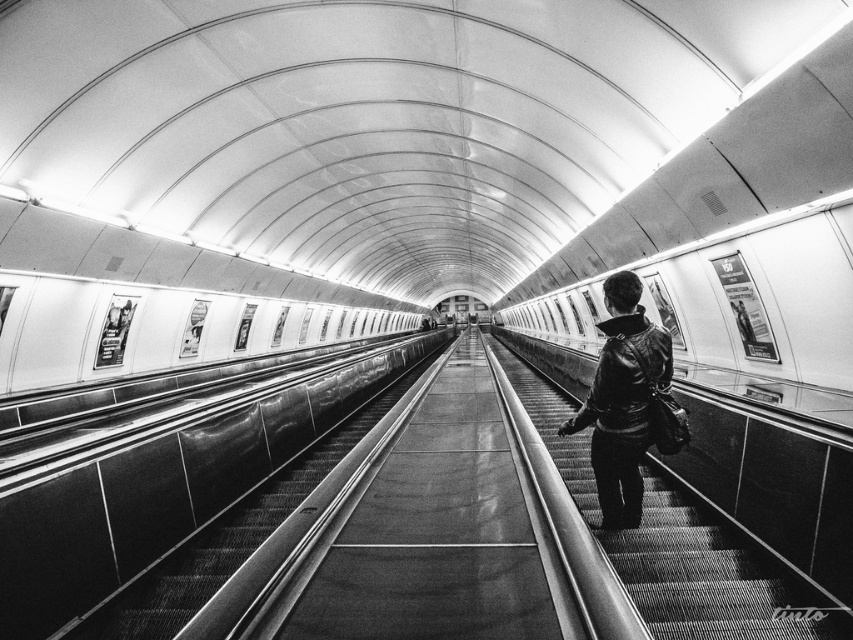
Question: Which point appears farthest from the camera in this image?

Choices:
 (A) (614, 568)
 (B) (633, 449)
 (C) (328, 456)

Answer: (C)

Question: Does metallic escalator steps at center lie behind metallic escalator at center?

Choices:
 (A) no
 (B) yes

Answer: (B)

Question: Can you confirm if metallic escalator steps at center is positioned to the left of metallic escalator at center?

Choices:
 (A) no
 (B) yes

Answer: (A)

Question: Which object appears farthest from the camera in this image?

Choices:
 (A) metallic escalator steps at center
 (B) metallic escalator at center
 (C) leather jacket at right

Answer: (C)

Question: Which object is positioned closest to the metallic escalator at center?

Choices:
 (A) leather jacket at right
 (B) metallic escalator steps at center

Answer: (A)

Question: Is metallic escalator at center bigger than leather jacket at right?

Choices:
 (A) no
 (B) yes

Answer: (B)